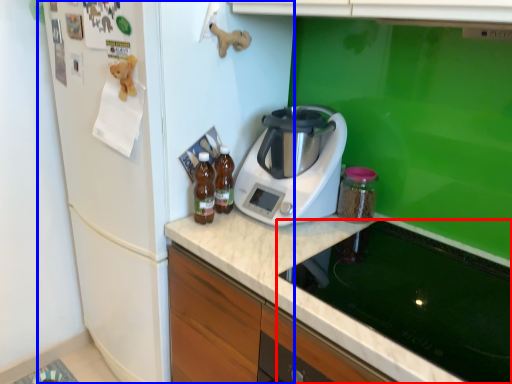
Question: Among these objects, which one is nearest to the camera, home appliance (highlighted by a red box) or fridge (highlighted by a blue box)?

Choices:
 (A) home appliance
 (B) fridge

Answer: (A)